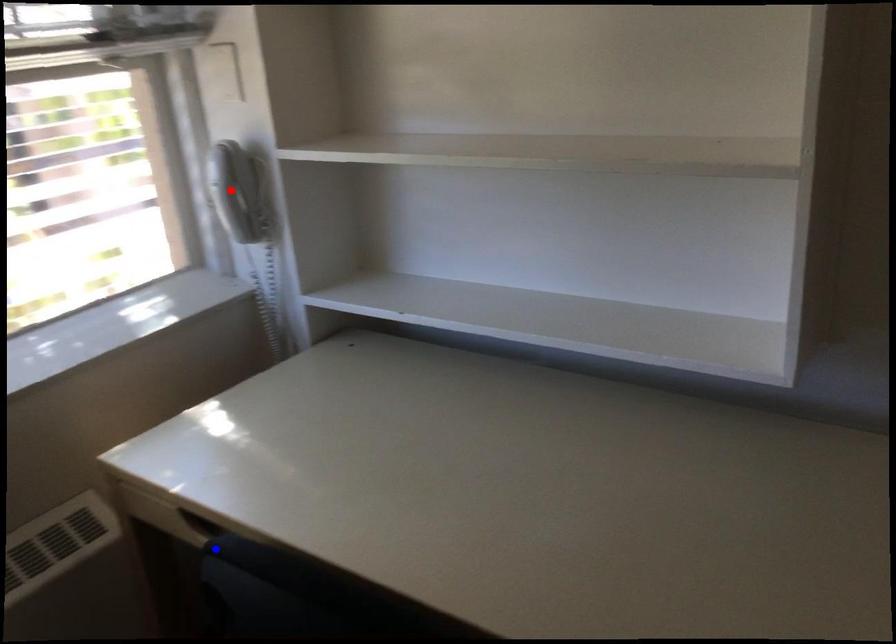
Question: Which of the two points in the image is closer to the camera?

Choices:
 (A) Blue point is closer.
 (B) Red point is closer.

Answer: (A)